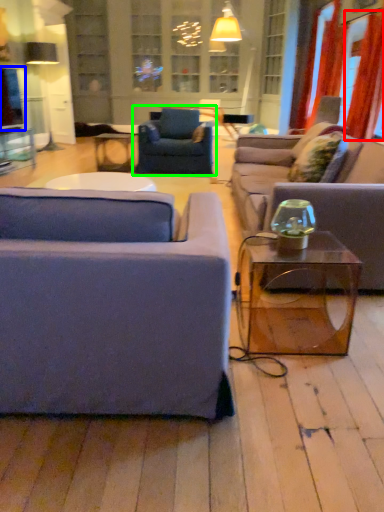
Question: Considering the real-world distances, which object is farthest from curtain (highlighted by a red box)? window screen (highlighted by a blue box) or chair (highlighted by a green box)?

Choices:
 (A) window screen
 (B) chair

Answer: (A)